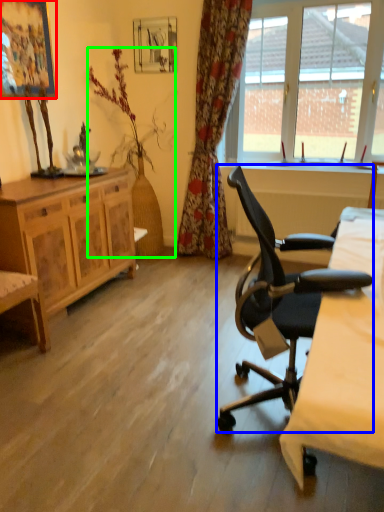
Question: Considering the real-world distances, which object is farthest from picture frame (highlighted by a red box)? chair (highlighted by a blue box) or houseplant (highlighted by a green box)?

Choices:
 (A) chair
 (B) houseplant

Answer: (A)